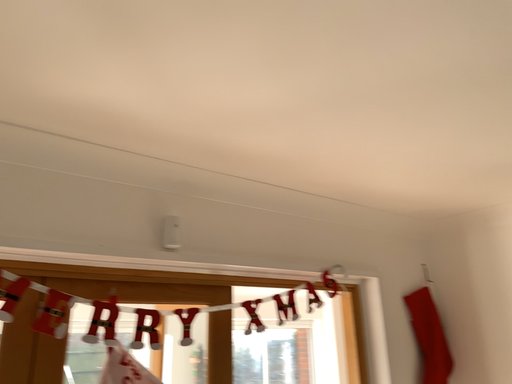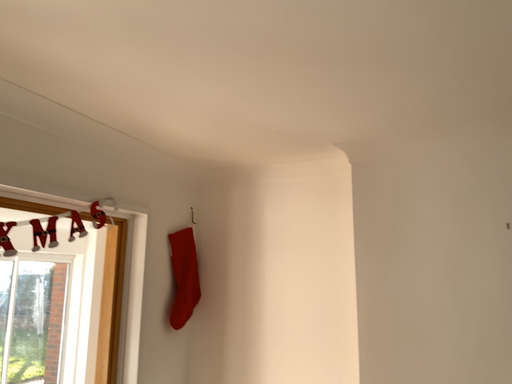
Question: How did the camera likely rotate when shooting the video?

Choices:
 (A) rotated left
 (B) rotated right

Answer: (B)